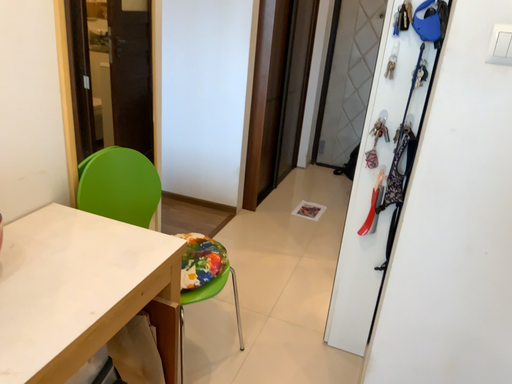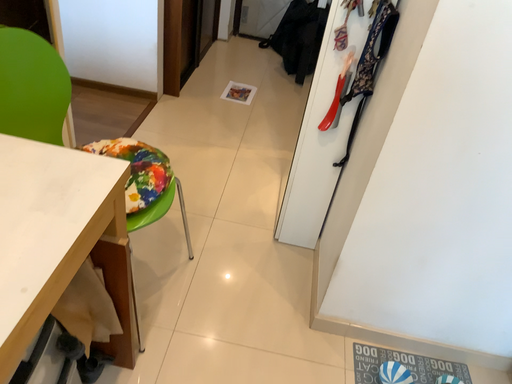
Question: Which way did the camera rotate in the video?

Choices:
 (A) rotated upward
 (B) rotated downward

Answer: (B)